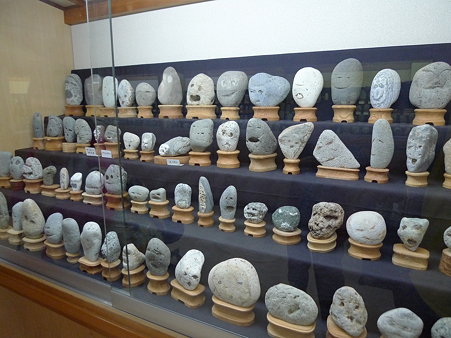
This screenshot has height=338, width=451. Identify the location of riser. (384, 196), (366, 133), (317, 281).